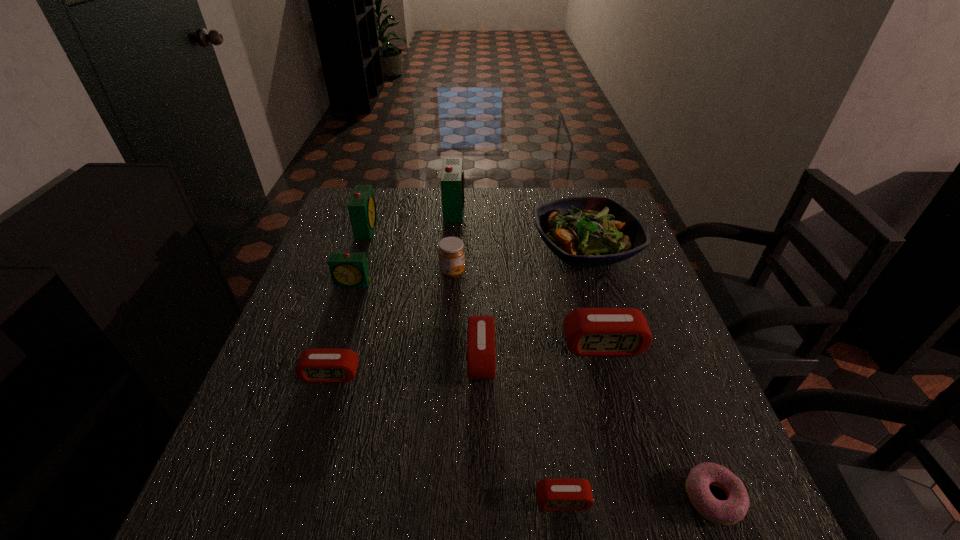
You are a GUI agent. You are given a task and a screenshot of the screen. Output one action in this format:
    pyautogui.click(x=<x>, y=<y>)
    Task: Click on the doughnut present at the near edge
    The image size is (960, 540).
    Given the screenshot: What is the action you would take?
    point(727,512)

Where is `salad plate situated at the right edge`? The height and width of the screenshot is (540, 960). salad plate situated at the right edge is located at coordinates (587, 231).

Where is `alarm clock located in the right edge section of the desktop`? The image size is (960, 540). alarm clock located in the right edge section of the desktop is located at coordinates (592, 332).

This screenshot has width=960, height=540. Find the location of `doughnut that is positioned at the right edge`. doughnut that is positioned at the right edge is located at coordinates [x=727, y=512].

Where is `object at the far left corner`? The height and width of the screenshot is (540, 960). object at the far left corner is located at coordinates (362, 210).

Locate an element on the screen. Image resolution: width=960 pixels, height=540 pixels. object present at the far right corner is located at coordinates (587, 231).

At what (x,y) coordinates should I click in order to perform the action: click on object present at the near right corner. Please return your answer as a coordinate pair (x, y). Looking at the image, I should click on (727, 512).

In the image, there is a desktop. At what (x,y) coordinates should I click in order to perform the action: click on blank space at the far edge. Please return your answer as a coordinate pair (x, y). Image resolution: width=960 pixels, height=540 pixels. Looking at the image, I should click on (477, 193).

At what (x,y) coordinates should I click in order to perform the action: click on vacant area at the near edge. Please return your answer as a coordinate pair (x, y). This screenshot has height=540, width=960. Looking at the image, I should click on (388, 531).

Locate an element on the screen. This screenshot has height=540, width=960. free space at the left edge of the desktop is located at coordinates (262, 442).